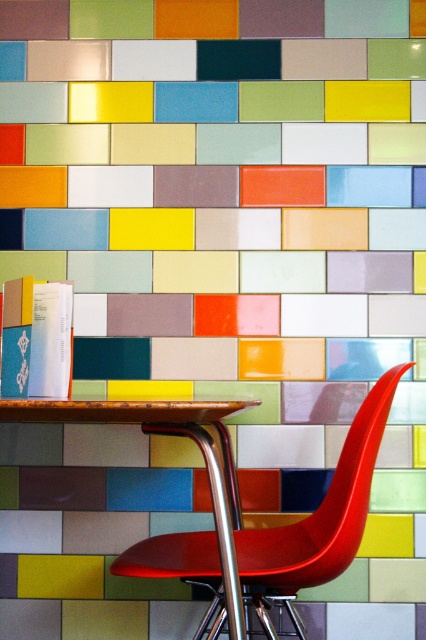
Question: Which of the following is the closest to the observer?

Choices:
 (A) shiny red plastic chair at center
 (B) wooden table at center

Answer: (B)

Question: Can you confirm if shiny red plastic chair at center is thinner than wooden table at center?

Choices:
 (A) yes
 (B) no

Answer: (B)

Question: Can you confirm if shiny red plastic chair at center is positioned to the left of wooden table at center?

Choices:
 (A) no
 (B) yes

Answer: (A)

Question: Does shiny red plastic chair at center appear on the left side of wooden table at center?

Choices:
 (A) yes
 (B) no

Answer: (B)